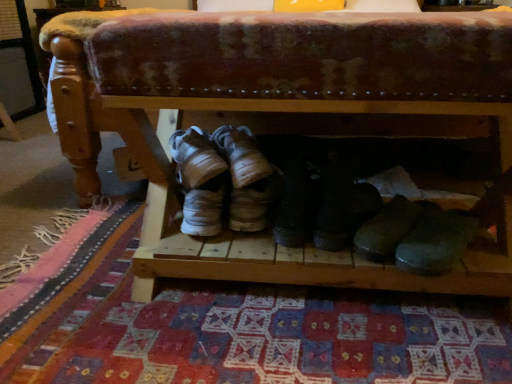
I want to click on black leather boot at center, arranged as the 3th footwear when viewed from the left, so click(343, 212).

What is the approximate width of black leather boot at center, marked as the 1th footwear in a right-to-left arrangement?

The width of black leather boot at center, marked as the 1th footwear in a right-to-left arrangement, is 4.99 inches.

The image size is (512, 384). Find the location of `black leather boots at center, the 2th footwear positioned from the left`. black leather boots at center, the 2th footwear positioned from the left is located at coordinates (295, 205).

Which of these two, black leather boots at center, the second footwear when ordered from right to left, or patterned carpet at lower center, is thinner?

With smaller width is black leather boots at center, the second footwear when ordered from right to left.

From a real-world perspective, does black leather boots at center, the 2th footwear positioned from the left, stand above patterned carpet at lower center?

Yes, from a real-world perspective, black leather boots at center, the 2th footwear positioned from the left, is over patterned carpet at lower center

In the image, is black leather boots at center, the second footwear when ordered from right to left, on the left side or the right side of patterned carpet at lower center?

From the image, it's evident that black leather boots at center, the second footwear when ordered from right to left, is to the right of patterned carpet at lower center.

From a real-world perspective, is black leather boot at center, arranged as the 3th footwear when viewed from the left, positioned under white suede sneakers at center, which is counted as the 1th footwear, starting from the left, based on gravity?

Indeed, from a real-world perspective, black leather boot at center, arranged as the 3th footwear when viewed from the left, is positioned beneath white suede sneakers at center, which is counted as the 1th footwear, starting from the left.

Is black leather boot at center, marked as the 1th footwear in a right-to-left arrangement, bigger or smaller than white suede sneakers at center, which is counted as the 1th footwear, starting from the left?

Considering their sizes, black leather boot at center, marked as the 1th footwear in a right-to-left arrangement, takes up less space than white suede sneakers at center, which is counted as the 1th footwear, starting from the left.

Between black leather boot at center, arranged as the 3th footwear when viewed from the left, and white suede sneakers at center, positioned as the 3th footwear in right-to-left order, which one has less height?

white suede sneakers at center, positioned as the 3th footwear in right-to-left order.

From the image's perspective, between patterned carpet at lower center and black leather boots at center, the 2th footwear positioned from the left, who is located below?

patterned carpet at lower center.

Starting from the patterned carpet at lower center, which footwear is the 2nd one behind? Please provide its 2D coordinates.

[(295, 205)]

Which is farther, (x=257, y=335) or (x=303, y=227)?

The point (x=303, y=227) is more distant.

Is patterned carpet at lower center facing towards black leather boots at center, the 2th footwear positioned from the left?

No.

From the picture: What's the angular difference between patterned carpet at lower center and white suede sneakers at center, positioned as the 3th footwear in right-to-left order,'s facing directions?

The angle between the facing direction of patterned carpet at lower center and the facing direction of white suede sneakers at center, positioned as the 3th footwear in right-to-left order, is 4.27 degrees.

The image size is (512, 384). I want to click on mat on the right of white suede sneakers at center, which is counted as the 1th footwear, starting from the left, so click(x=248, y=331).

Which object is thinner, patterned carpet at lower center or white suede sneakers at center, which is counted as the 1th footwear, starting from the left?

white suede sneakers at center, which is counted as the 1th footwear, starting from the left.

Is patterned carpet at lower center aimed at white suede sneakers at center, positioned as the 3th footwear in right-to-left order?

No, patterned carpet at lower center is not turned towards white suede sneakers at center, positioned as the 3th footwear in right-to-left order.

From the image's perspective, is black leather boot at center, marked as the 1th footwear in a right-to-left arrangement, beneath patterned carpet at lower center?

Actually, black leather boot at center, marked as the 1th footwear in a right-to-left arrangement, appears above patterned carpet at lower center in the image.

Considering the sizes of black leather boot at center, marked as the 1th footwear in a right-to-left arrangement, and patterned carpet at lower center in the image, is black leather boot at center, marked as the 1th footwear in a right-to-left arrangement, taller or shorter than patterned carpet at lower center?

In the image, black leather boot at center, marked as the 1th footwear in a right-to-left arrangement, appears to be taller than patterned carpet at lower center.

Does point (324, 192) come closer to viewer compared to point (300, 331)?

No, (324, 192) is further to viewer.

In the scene shown: Based on their positions, is white suede sneakers at center, which is counted as the 1th footwear, starting from the left, located to the left or right of wooden shoe rack at center?

From the image, it's evident that white suede sneakers at center, which is counted as the 1th footwear, starting from the left, is to the left of wooden shoe rack at center.

Considering the sizes of white suede sneakers at center, which is counted as the 1th footwear, starting from the left, and wooden shoe rack at center in the image, is white suede sneakers at center, which is counted as the 1th footwear, starting from the left, bigger or smaller than wooden shoe rack at center?

white suede sneakers at center, which is counted as the 1th footwear, starting from the left, is smaller than wooden shoe rack at center.

Considering the relative positions of white suede sneakers at center, which is counted as the 1th footwear, starting from the left, and wooden shoe rack at center in the image provided, is white suede sneakers at center, which is counted as the 1th footwear, starting from the left, behind wooden shoe rack at center?

That is True.

Could you tell me if black leather boots at center, the 2th footwear positioned from the left, is facing black leather boot at center, arranged as the 3th footwear when viewed from the left?

No.

Considering the relative positions of black leather boots at center, the second footwear when ordered from right to left, and black leather boot at center, marked as the 1th footwear in a right-to-left arrangement, in the image provided, is black leather boots at center, the second footwear when ordered from right to left, to the left of black leather boot at center, marked as the 1th footwear in a right-to-left arrangement, from the viewer's perspective?

Correct, you'll find black leather boots at center, the second footwear when ordered from right to left, to the left of black leather boot at center, marked as the 1th footwear in a right-to-left arrangement.

Between black leather boots at center, the 2th footwear positioned from the left, and black leather boot at center, marked as the 1th footwear in a right-to-left arrangement, which one has larger size?

black leather boots at center, the 2th footwear positioned from the left, is bigger.

From a real-world perspective, count 2nd footwears upward from the patterned carpet at lower center and point to it. Please provide its 2D coordinates.

[(295, 205)]

The height and width of the screenshot is (384, 512). I want to click on the 2nd footwear counting from the right side of the white suede sneakers at center, positioned as the 3th footwear in right-to-left order, so click(343, 212).

Based on the photo, based on their spatial positions, is black leather boot at center, arranged as the 3th footwear when viewed from the left, or black leather boots at center, the 2th footwear positioned from the left, closer to wooden shoe rack at center?

Based on the image, black leather boot at center, arranged as the 3th footwear when viewed from the left, appears to be nearer to wooden shoe rack at center.

Looking at the image, which one is located further to black leather boot at center, marked as the 1th footwear in a right-to-left arrangement, black leather boots at center, the second footwear when ordered from right to left, or wooden shoe rack at center?

wooden shoe rack at center is positioned further to the anchor black leather boot at center, marked as the 1th footwear in a right-to-left arrangement.

Looking at this image, from the image, which object appears to be farther from patterned carpet at lower center, black leather boots at center, the second footwear when ordered from right to left, or black leather boot at center, arranged as the 3th footwear when viewed from the left?

Based on the image, black leather boots at center, the second footwear when ordered from right to left, appears to be further to patterned carpet at lower center.

When comparing their distances from wooden shoe rack at center, does black leather boot at center, marked as the 1th footwear in a right-to-left arrangement, or patterned carpet at lower center seem further?

black leather boot at center, marked as the 1th footwear in a right-to-left arrangement, lies further to wooden shoe rack at center than the other object.

Which object lies further to the anchor point black leather boot at center, marked as the 1th footwear in a right-to-left arrangement, white suede sneakers at center, positioned as the 3th footwear in right-to-left order, or patterned carpet at lower center?

patterned carpet at lower center is positioned further to the anchor black leather boot at center, marked as the 1th footwear in a right-to-left arrangement.

Considering their positions, is wooden shoe rack at center positioned further to white suede sneakers at center, positioned as the 3th footwear in right-to-left order, than black leather boot at center, marked as the 1th footwear in a right-to-left arrangement?

wooden shoe rack at center is further to white suede sneakers at center, positioned as the 3th footwear in right-to-left order.

From the image, which object appears to be farther from black leather boots at center, the second footwear when ordered from right to left, black leather boot at center, marked as the 1th footwear in a right-to-left arrangement, or wooden shoe rack at center?

wooden shoe rack at center is positioned further to the anchor black leather boots at center, the second footwear when ordered from right to left.

Estimate the real-world distances between objects in this image. Which object is closer to black leather boots at center, the 2th footwear positioned from the left, patterned carpet at lower center or black leather boot at center, marked as the 1th footwear in a right-to-left arrangement?

black leather boot at center, marked as the 1th footwear in a right-to-left arrangement, is closer to black leather boots at center, the 2th footwear positioned from the left.

Image resolution: width=512 pixels, height=384 pixels. I want to click on furniture between patterned carpet at lower center and black leather boots at center, the second footwear when ordered from right to left, from front to back, so tap(286, 119).

Locate an element on the screen. footwear between white suede sneakers at center, which is counted as the 1th footwear, starting from the left, and wooden shoe rack at center, in the horizontal direction is located at coordinates (295, 205).

This screenshot has height=384, width=512. What are the coordinates of `mat between white suede sneakers at center, which is counted as the 1th footwear, starting from the left, and black leather boot at center, arranged as the 3th footwear when viewed from the left, in the horizontal direction` in the screenshot? It's located at (248, 331).

Identify the location of footwear between white suede sneakers at center, positioned as the 3th footwear in right-to-left order, and black leather boot at center, marked as the 1th footwear in a right-to-left arrangement. (295, 205).